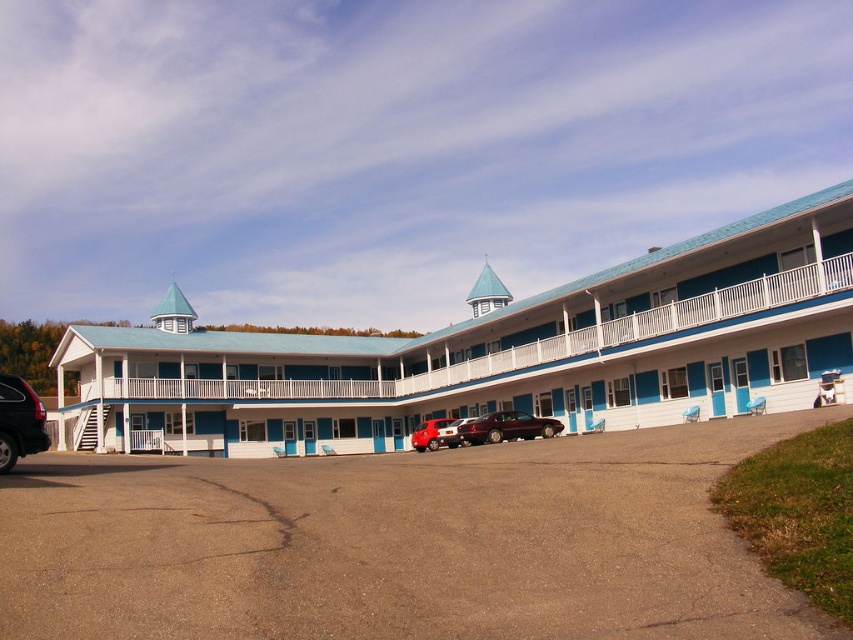
You are a delivery driver arriving at the two story building with a package for the main entrance. You see a shiny maroon sedan at center and a metallic silver van at center in the parking lot. Which vehicle should you park to the left of to avoid blocking the entrance?

You should park to the left of the metallic silver van at center because the shiny maroon sedan at center is on the right side of it, so placing your vehicle to the left of the metallic silver van at center would keep the entrance clear.